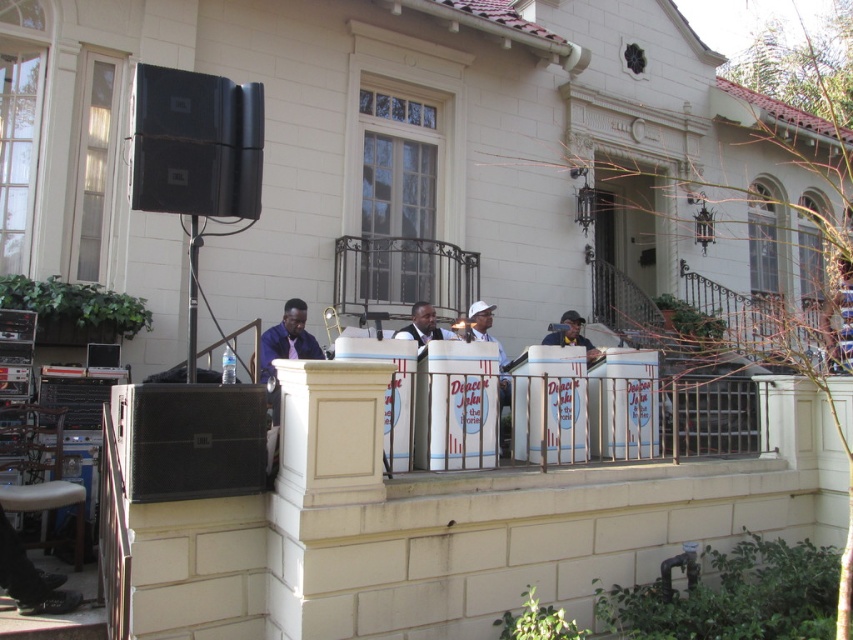
You are standing at the base of the building and want to locate two specific points on the balcony. The first point is at coordinate point (151, 200) and the second is at point (184, 456). From your vantage point, which point appears closer to you?

Point (184, 456) appears closer because it is in front of point (151, 200).

You are a sound technician setting up for the Deacon John event. You need to place two black matte speakers so that they are exactly 4 feet apart. The current setup has the black matte speaker at upper left and the black matte speaker at lower left. Do you need to adjust their positions?

The black matte speaker at upper left and black matte speaker at lower left are currently 3.90 feet apart. Since 3.90 feet is slightly less than 4 feet, you need to move them slightly further apart to meet the requirement.